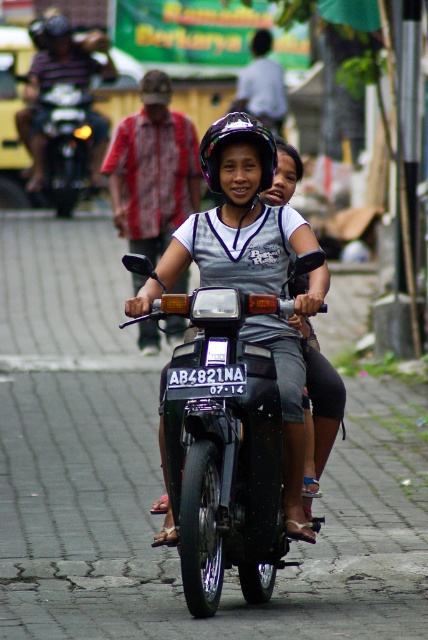
Question: Is black glossy motorcycle at center to the left of white fabric shirt at upper center from the viewer's perspective?

Choices:
 (A) yes
 (B) no

Answer: (A)

Question: Is shiny black motorcycle at left positioned before white fabric shirt at upper center?

Choices:
 (A) no
 (B) yes

Answer: (B)

Question: Among these points, which one is nearest to the camera?

Choices:
 (A) (62, 122)
 (B) (237, 132)

Answer: (B)

Question: Which object is positioned closest to the matte black helmet at center?

Choices:
 (A) white fabric shirt at upper center
 (B) shiny black motorcycle at left
 (C) matte black helmet at upper center

Answer: (A)

Question: Can you confirm if shiny black motorcycle at left is smaller than white fabric shirt at upper center?

Choices:
 (A) no
 (B) yes

Answer: (B)

Question: Which object is the farthest from the matte black helmet at upper center?

Choices:
 (A) shiny black motorcycle at left
 (B) matte black helmet at center
 (C) black glossy motorcycle at center

Answer: (C)